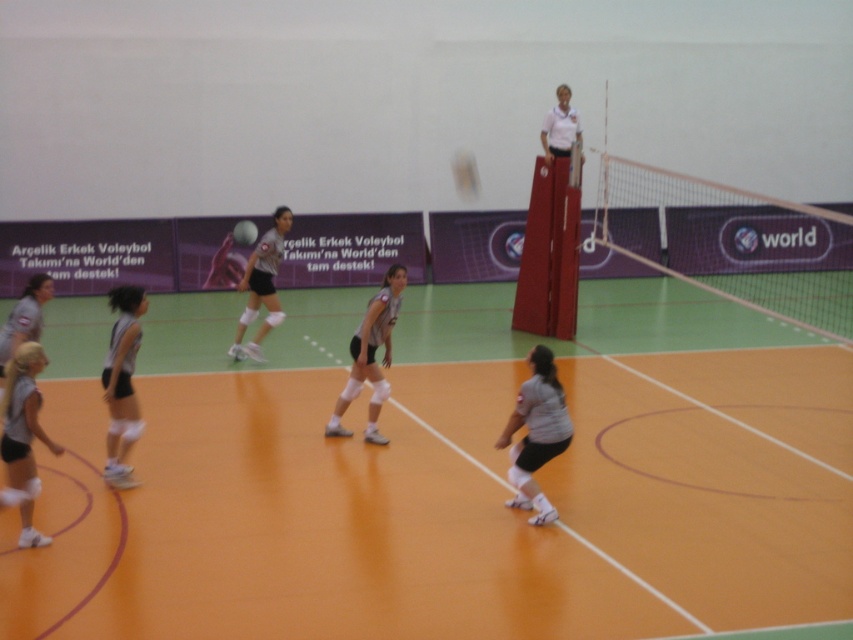
You are a photographer positioned at the back of the court. You want to capture a closeup of the gray matte uniform at lower left and the white matte volleyball at center in the same frame. Considering their sizes, which object should you zoom in on more to ensure both are clearly visible?

The gray matte uniform at lower left is bigger than the white matte volleyball at center, so you should zoom in more on the white matte volleyball at center to balance their sizes in the frame.

You are a photographer standing at the back of the court. You want to take a photo that includes both the white mesh net at upper center and the matte gray shorts at lower left. Which object should you adjust your camera focus on first to ensure both are in the frame?

The white mesh net at upper center is further to the viewer than the matte gray shorts at lower left. To ensure both are in the frame, focus on the white mesh net at upper center first, then adjust to include the matte gray shorts at lower left.